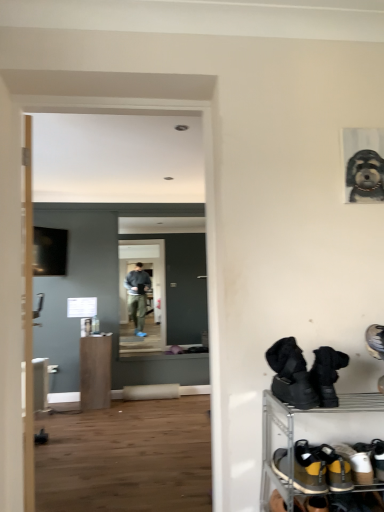
Question: Is black suede boots at lower right, which is the third footwear from bottom to top, surrounded by yellow suede sneakers at lower right, the first footwear in the bottom-to-top sequence?

Choices:
 (A) no
 (B) yes

Answer: (A)

Question: Is yellow suede sneakers at lower right, which is the third footwear from top to bottom, facing towards black suede boots at lower right, arranged as the first footwear when viewed from the top?

Choices:
 (A) no
 (B) yes

Answer: (A)

Question: Is yellow suede sneakers at lower right, the first footwear in the bottom-to-top sequence, at the left side of black suede boots at lower right, arranged as the first footwear when viewed from the top?

Choices:
 (A) yes
 (B) no

Answer: (A)

Question: Is yellow suede sneakers at lower right, which is the third footwear from top to bottom, smaller than black suede boots at lower right, arranged as the first footwear when viewed from the top?

Choices:
 (A) yes
 (B) no

Answer: (A)

Question: Is yellow suede sneakers at lower right, the first footwear in the bottom-to-top sequence, thinner than black suede boots at lower right, which is the third footwear from bottom to top?

Choices:
 (A) no
 (B) yes

Answer: (A)

Question: Is gray textured dog portrait at upper right to the left or to the right of yellow suede sneakers at lower right, which is the third footwear from top to bottom, in the image?

Choices:
 (A) left
 (B) right

Answer: (B)

Question: Considering the positions of gray textured dog portrait at upper right and yellow suede sneakers at lower right, which is the third footwear from top to bottom, in the image, is gray textured dog portrait at upper right bigger or smaller than yellow suede sneakers at lower right, which is the third footwear from top to bottom,?

Choices:
 (A) big
 (B) small

Answer: (B)

Question: From the image's perspective, relative to yellow suede sneakers at lower right, the first footwear in the bottom-to-top sequence, is gray textured dog portrait at upper right above or below?

Choices:
 (A) below
 (B) above

Answer: (B)

Question: Is point (375, 184) closer or farther from the camera than point (307, 454)?

Choices:
 (A) farther
 (B) closer

Answer: (A)

Question: Would you say brown suede shoes at lower right, which ranks as the second footwear in bottom-to-top order, is to the left or to the right of gray textured dog portrait at upper right in the picture?

Choices:
 (A) left
 (B) right

Answer: (A)

Question: Is brown suede shoes at lower right, the second footwear viewed from the top, in front of or behind gray textured dog portrait at upper right in the image?

Choices:
 (A) behind
 (B) front

Answer: (B)

Question: Is point tap(334, 486) closer or farther from the camera than point tap(364, 175)?

Choices:
 (A) farther
 (B) closer

Answer: (B)

Question: Do you think brown suede shoes at lower right, which ranks as the second footwear in bottom-to-top order, is within gray textured dog portrait at upper right, or outside of it?

Choices:
 (A) inside
 (B) outside

Answer: (B)

Question: Is brown suede shoes at lower right, the second footwear viewed from the top, taller or shorter than black rubber boots at lower right?

Choices:
 (A) tall
 (B) short

Answer: (B)

Question: From the image's perspective, is brown suede shoes at lower right, the second footwear viewed from the top, above or below black rubber boots at lower right?

Choices:
 (A) below
 (B) above

Answer: (B)